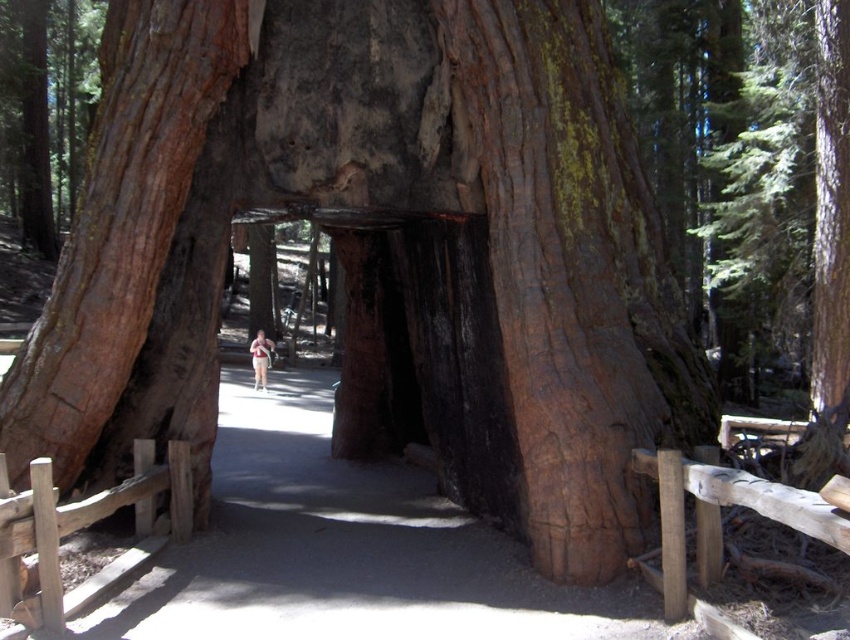
You are standing at the entrance of the tree trunk tunnel and want to locate the smooth brown bark at center. According to the coordinates provided, where should you look in the image?

The smooth brown bark at center is located at the coordinates point (573, 275) in the image.

You are standing at the entrance of the hollowed tree trunk tunnel and want to take a photo of the smooth brown bark at left. If your camera has a maximum focus distance of 5 meters, will it be able to capture the bark clearly?

The smooth brown bark at left is 5.35 meters away from the camera, which exceeds the maximum focus distance of 5 meters. Therefore, the camera won not be able to capture the bark clearly.